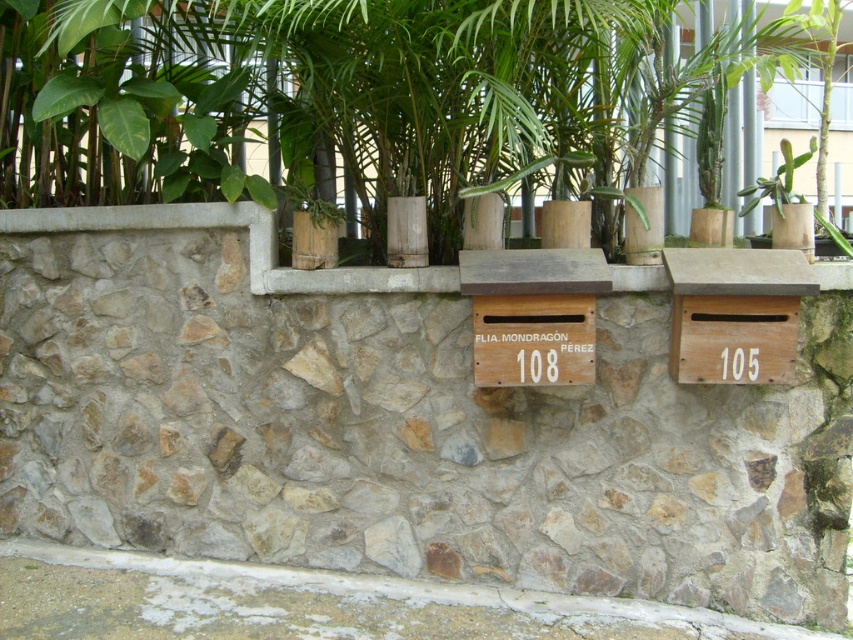
You are a postal worker delivering a package and need to place it in the correct mailbox. You see a natural stone mailbox at center and a green leafy plant at upper center. Which one is taller?

The natural stone mailbox at center is much taller than the green leafy plant at upper center.

You are a delivery person trying to place a package on the white stone ledge at lower center. However, there is a green leafy plant at upper center in the way. From your perspective, which direction should you move the plant to clear the ledge?

The green leafy plant at upper center is to the right of the white stone ledge at lower center. To clear the ledge, move the plant to the left so it is no longer blocking the ledge.

You are standing in front of the stone wall with two mailboxes. You notice a point marked at coordinate (337, 93). What object is located at that point?

The point at coordinate (337, 93) marks the location of the green leafy plant at upper center.